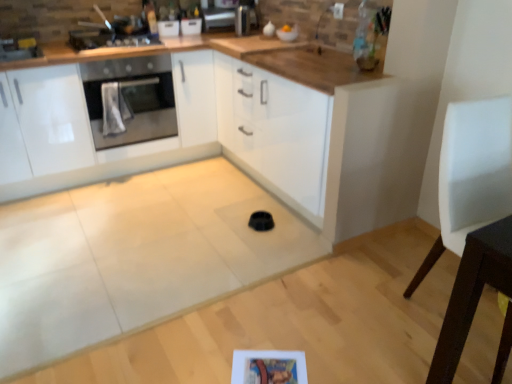
Image resolution: width=512 pixels, height=384 pixels. What are the coordinates of `vacant space behind white leather chair at right` in the screenshot? It's located at (413, 257).